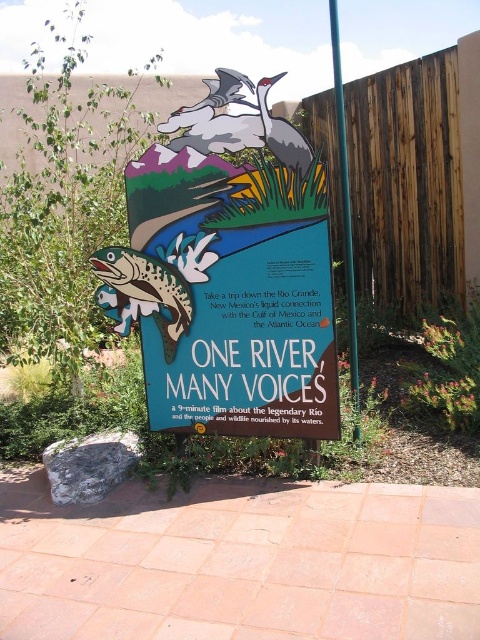
Is point (155, 285) behind point (344, 116)?

No, it is in front of (344, 116).

Is shiny metallic fish at center behind green painted wood pole at center?

No, it is in front of green painted wood pole at center.

Find the location of a particular element. This screenshot has height=640, width=480. shiny metallic fish at center is located at coordinates (143, 292).

Is matte green signboard at center positioned at the back of green painted wood pole at center?

No, matte green signboard at center is in front of green painted wood pole at center.

Between point (314, 360) and point (342, 113), which one is positioned in front?

Point (314, 360) is in front.

Locate an element on the screen. The width and height of the screenshot is (480, 640). matte green signboard at center is located at coordinates (237, 296).

In order to click on matte green signboard at center in this screenshot , I will do `click(237, 296)`.

Does matte green signboard at center have a greater height compared to shiny metallic fish at center?

Yes.

Is point (327, 218) positioned after point (184, 280)?

No.

Find the location of a particular element. Image resolution: width=480 pixels, height=640 pixels. matte green signboard at center is located at coordinates (237, 296).